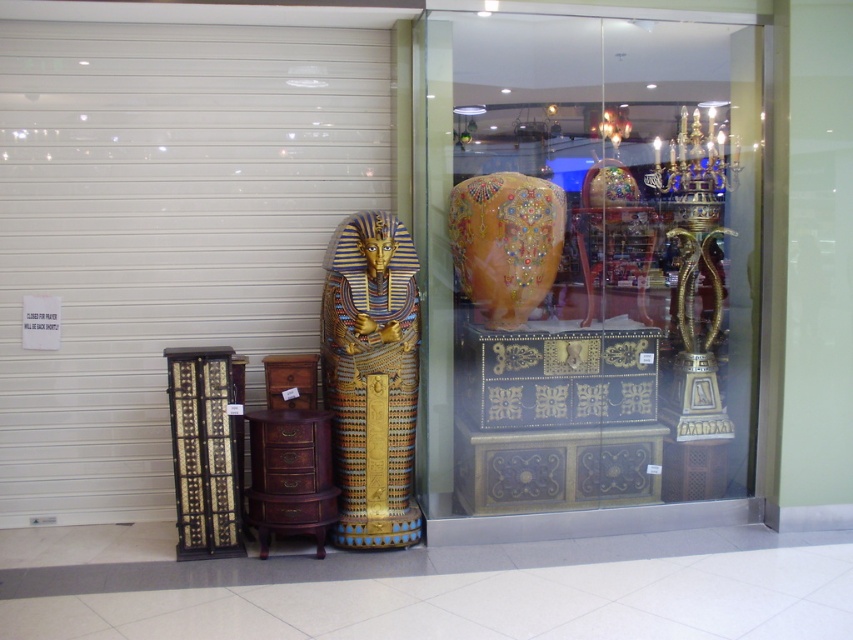
You are an interior designer planning to place a tall plant next to the two vases in the display area. Which vase should you place the plant behind to ensure it is partially hidden from view? Please choose between the matte gold vase at center and the golden glossy vase at center.

The matte gold vase at center is taller than the golden glossy vase at center, so placing the plant behind the matte gold vase at center would better hide it from view.

Consider the image. You are an interior designer planning to place a 2.5 meters tall statue in this display area. The statue will be positioned where the golden glossy vase at center currently is. Considering the height of the gold metallic sarcophagus at center, will the statue fit without being taller than it?

The gold metallic sarcophagus at center is much taller as golden glossy vase at center. Since the statue is 2.5 meters tall and will replace the vase, we need to compare its height to the sarcophagus. However, the description only states the sarcophagus is taller than the vase, but doesn not provide exact measurements. Without knowing the sarcophagus height, we cannot confirm if the 2.5m statue will fit under it.

You are an interior designer arranging a display. You have a matte gold vase at center and a gold metallic sarcophagus at center. Which object should you place higher to maintain symmetry?

The matte gold vase at center should be placed higher than the gold metallic sarcophagus at center to maintain symmetry, as the description states that the matte gold vase at center is located above the gold metallic sarcophagus at center.